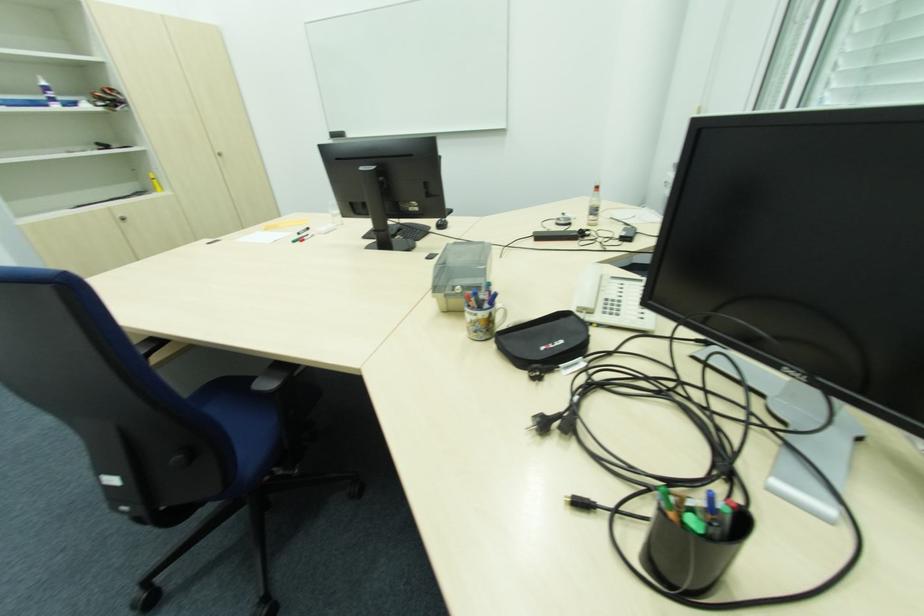
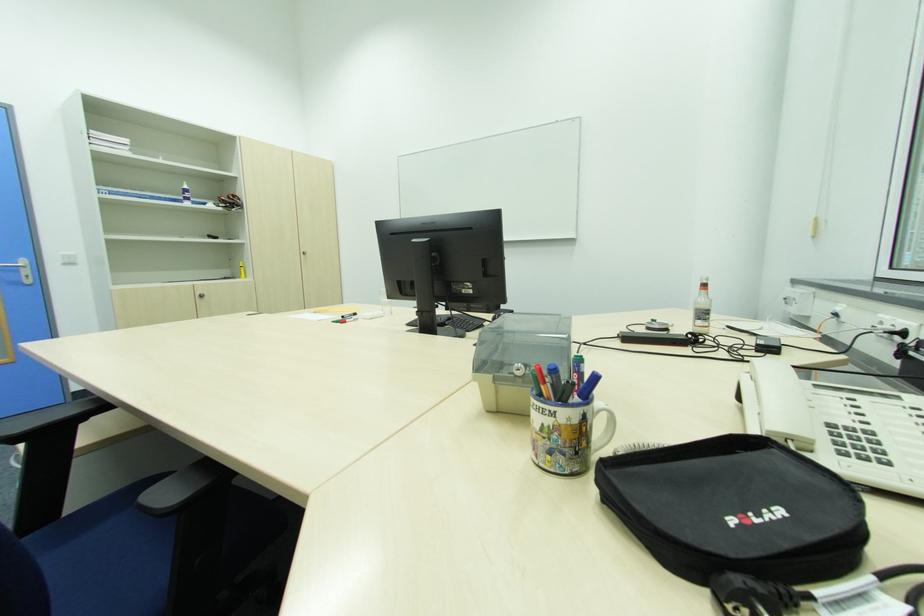
Locate, in the second image, the point that corresponds to [594,217] in the first image.

(702, 323)